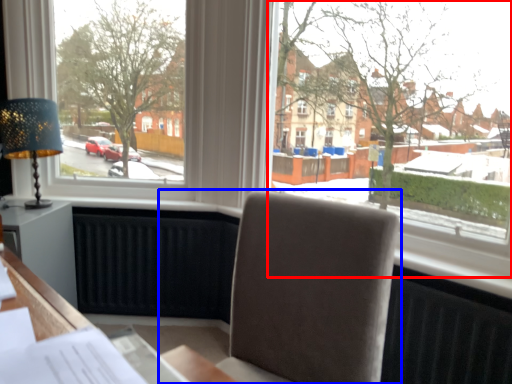
Question: Which point is closer to the camera, window (highlighted by a red box) or chair (highlighted by a blue box)?

Choices:
 (A) window
 (B) chair

Answer: (B)